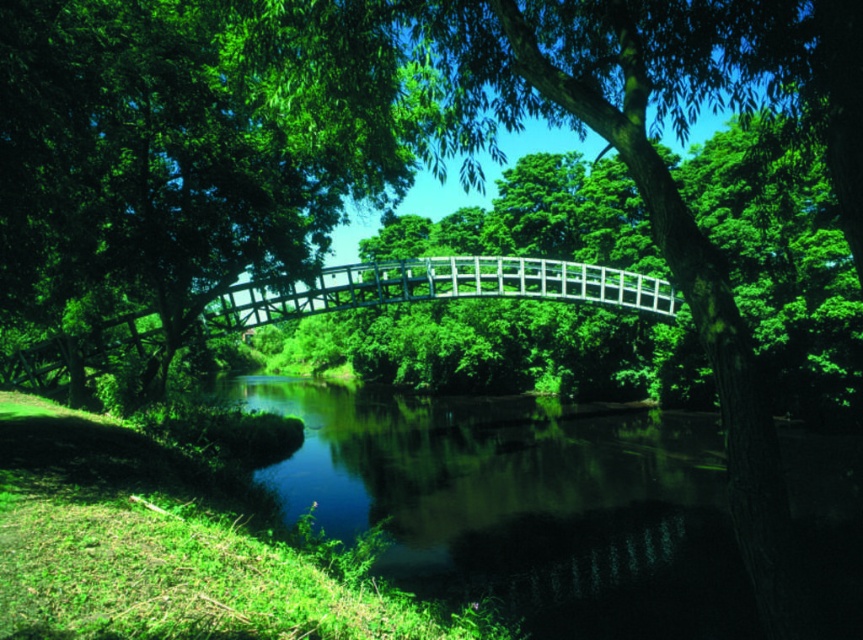
Based on the photo, you are standing on the white wooden bridge at center and want to see the green reflective water at center. In which direction should you look relative to the bridge?

You should look to the right side of the white wooden bridge at center to see the green reflective water at center, as it is positioned on the right side of the bridge.